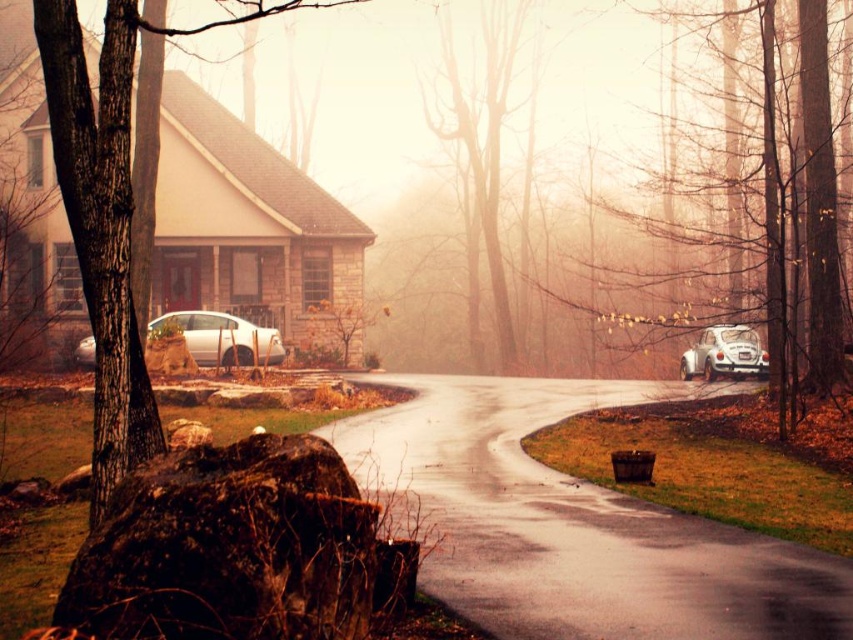
You are standing at the point marked by coordinates point (100, 225) in the image. What object are you directly facing?

You are directly facing the brown rough bark tree at left.

You are a driver approaching the white matte car at right and the smooth bark tree at right. Based on their positions, which one would you need to navigate around first?

The smooth bark tree at right is located above the white matte car at right, so you would need to navigate around the white matte car at right first since it is closer to your path.

You are a photographer planning to capture the brown rough tree at left and the white matte car at right in a single frame. Considering their sizes, which object should you position closer to the camera to ensure both are visible clearly in the photo?

The brown rough tree at left is larger than the white matte car at right. To ensure both are visible clearly in the photo, you should position the white matte car at right closer to the camera since it is smaller and needs to be enlarged in the frame to balance with the larger tree.